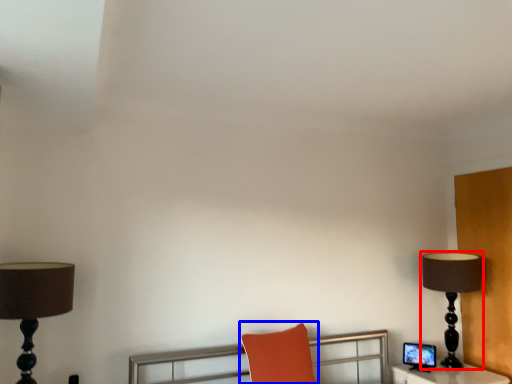
Question: Among these objects, which one is nearest to the camera, lamp (highlighted by a red box) or swivel chair (highlighted by a blue box)?

Choices:
 (A) lamp
 (B) swivel chair

Answer: (B)